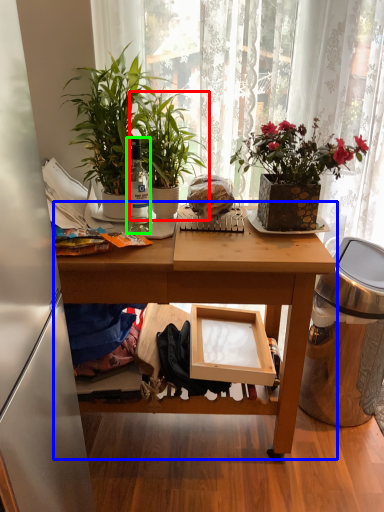
Question: Which object is positioned farthest from houseplant (highlighted by a red box)? Select from table (highlighted by a blue box) and bottle (highlighted by a green box).

Choices:
 (A) table
 (B) bottle

Answer: (A)